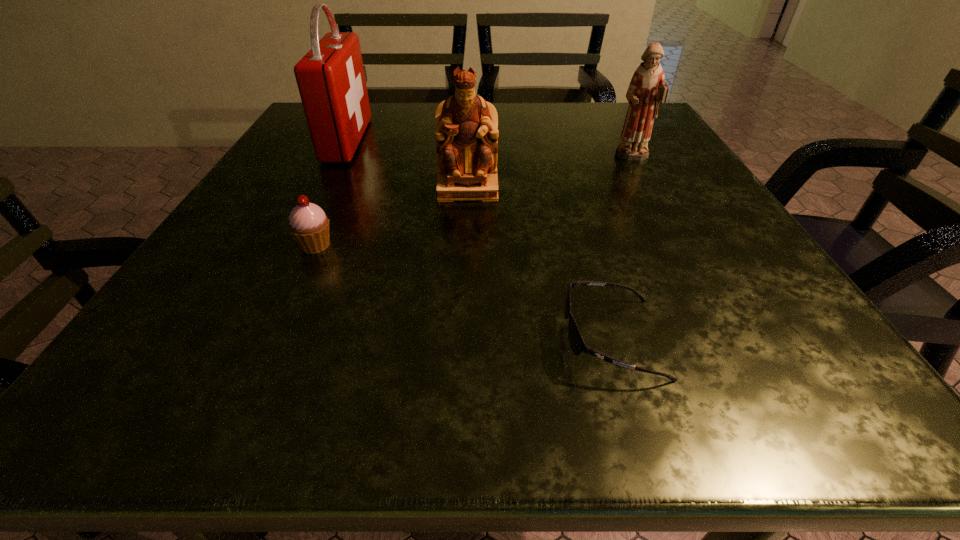
Locate an element on the screen. The height and width of the screenshot is (540, 960). the first-aid kit is located at coordinates (331, 80).

The width and height of the screenshot is (960, 540). Find the location of `the right figurine`. the right figurine is located at coordinates (647, 89).

You are a GUI agent. You are given a task and a screenshot of the screen. Output one action in this format:
    pyautogui.click(x=<x>, y=<y>)
    Task: Click on the farther figurine
    The height and width of the screenshot is (540, 960).
    Given the screenshot: What is the action you would take?
    pyautogui.click(x=647, y=89)

Locate an element on the screen. The image size is (960, 540). the third nearest object is located at coordinates (466, 132).

This screenshot has height=540, width=960. What are the coordinates of `the left figurine` in the screenshot? It's located at tap(466, 132).

This screenshot has height=540, width=960. Find the location of `the second nearest object`. the second nearest object is located at coordinates (309, 225).

The height and width of the screenshot is (540, 960). I want to click on the fourth tallest object, so click(x=309, y=225).

The width and height of the screenshot is (960, 540). In order to click on sunglasses in this screenshot , I will do `click(577, 344)`.

Identify the location of the nearest object. This screenshot has height=540, width=960. (577, 344).

Find the location of a particular element. The height and width of the screenshot is (540, 960). vacant space located on the front face of the tallest object is located at coordinates (404, 140).